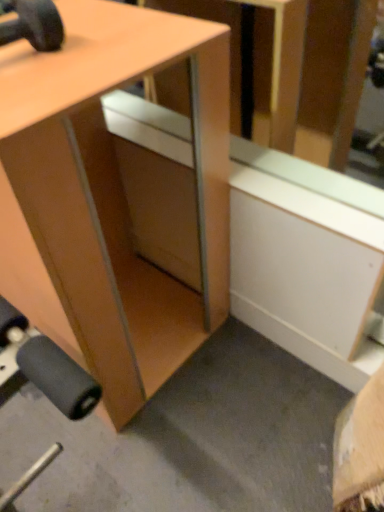
Question: Can matte black dumbbell at upper left be found inside matte wood desk at center?

Choices:
 (A) no
 (B) yes

Answer: (A)

Question: Considering the relative sizes of matte wood desk at center and matte black dumbbell at upper left in the image provided, is matte wood desk at center bigger than matte black dumbbell at upper left?

Choices:
 (A) no
 (B) yes

Answer: (B)

Question: Is matte wood desk at center behind matte black dumbbell at upper left?

Choices:
 (A) yes
 (B) no

Answer: (B)

Question: Could you tell me if matte wood desk at center is facing matte black dumbbell at upper left?

Choices:
 (A) yes
 (B) no

Answer: (B)

Question: Is the surface of matte wood desk at center in direct contact with matte black dumbbell at upper left?

Choices:
 (A) no
 (B) yes

Answer: (A)

Question: From a real-world perspective, does matte wood desk at center stand above matte black dumbbell at upper left?

Choices:
 (A) yes
 (B) no

Answer: (B)

Question: From the image's perspective, does matte black dumbbell at upper left appear higher than matte wood desk at center?

Choices:
 (A) no
 (B) yes

Answer: (B)

Question: Is matte black dumbbell at upper left far away from matte wood desk at center?

Choices:
 (A) no
 (B) yes

Answer: (A)

Question: Is matte black dumbbell at upper left looking in the opposite direction of matte wood desk at center?

Choices:
 (A) yes
 (B) no

Answer: (B)

Question: Is matte black dumbbell at upper left closer to camera compared to matte wood desk at center?

Choices:
 (A) no
 (B) yes

Answer: (A)

Question: Can you confirm if matte black dumbbell at upper left is thinner than matte wood desk at center?

Choices:
 (A) no
 (B) yes

Answer: (B)

Question: Is matte black dumbbell at upper left aimed at matte wood desk at center?

Choices:
 (A) no
 (B) yes

Answer: (A)

Question: From a real-world perspective, relative to matte black dumbbell at upper left, is matte wood desk at center vertically above or below?

Choices:
 (A) above
 (B) below

Answer: (B)